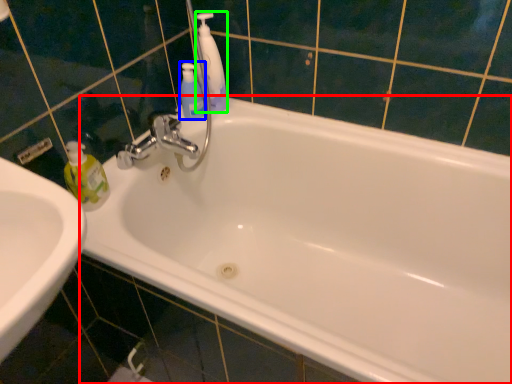
Question: Which object is the farthest from bathtub (highlighted by a red box)? Choose among these: mouthwash (highlighted by a blue box) or cleaning product (highlighted by a green box).

Choices:
 (A) mouthwash
 (B) cleaning product

Answer: (A)